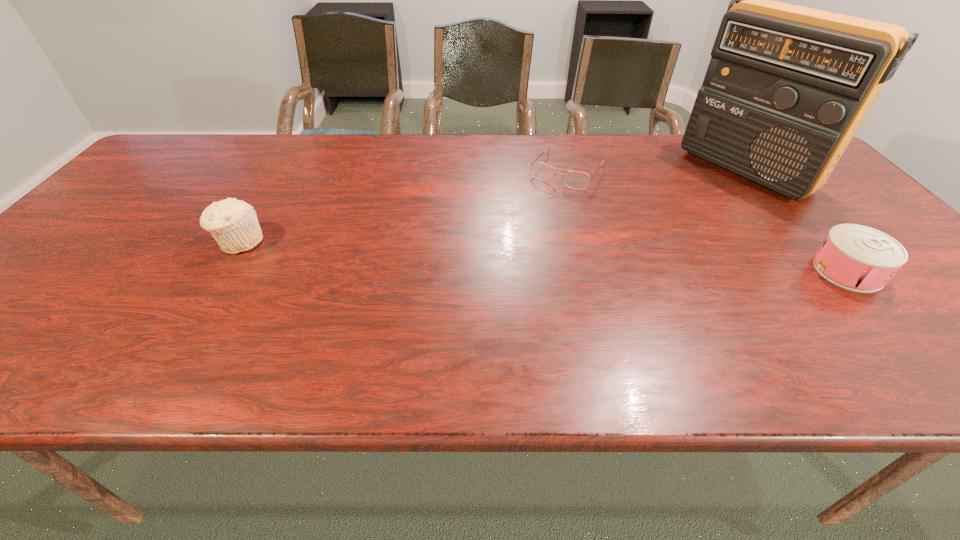
This screenshot has width=960, height=540. In order to click on free space at the near edge of the desktop in this screenshot , I will do `click(879, 308)`.

Identify the location of blank area at the left edge. The width and height of the screenshot is (960, 540). (174, 180).

At what (x,y) coordinates should I click in order to perform the action: click on vacant space at the far left corner of the desktop. Please return your answer as a coordinate pair (x, y). The height and width of the screenshot is (540, 960). Looking at the image, I should click on (205, 140).

Identify the location of free space at the near left corner of the desktop. (36, 334).

The width and height of the screenshot is (960, 540). I want to click on free point between the leftmost object and the shortest object, so pyautogui.click(x=403, y=207).

Find the location of a particular element. The image size is (960, 540). free space between the spectacles and the second shortest object is located at coordinates (708, 221).

Find the location of a particular element. This screenshot has height=540, width=960. free space between the spectacles and the tallest object is located at coordinates (657, 171).

Identify the location of vacant space in between the leftmost object and the shortest object. The image size is (960, 540). (403, 207).

Locate an element on the screen. Image resolution: width=960 pixels, height=540 pixels. unoccupied position between the can and the spectacles is located at coordinates click(x=708, y=221).

Identify the location of vacant area between the radio receiver and the muffin. Image resolution: width=960 pixels, height=540 pixels. (492, 206).